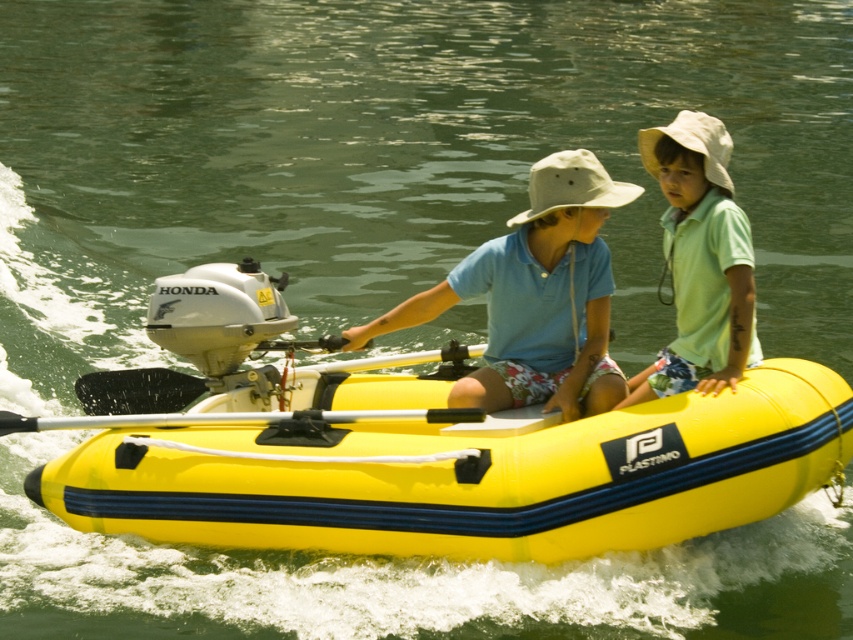
You are a safety inspector checking the boat setup. The yellow rubber boat at center must be positioned correctly relative to the silver metallic paddle at center for safe operation. According to the manufacturer guidelines, the boat should always be in front of the paddle to prevent engine damage. Is the current arrangement compliant with safety standards?

The yellow rubber boat at center is in front of the silver metallic paddle at center, which aligns with the manufacturer guidelines. This arrangement prevents engine damage and is compliant with safety standards.

You are a safety inspector checking the distance between the yellow rubber boat at center and the green matte shirt at upper right. The safety regulation requires a minimum distance of 2 meters between any two objects on a boat for emergency exits. Is the current distance compliant with the regulation?

The yellow rubber boat at center and the green matte shirt at upper right are 2.15 meters apart, which exceeds the minimum required distance of 2 meters. Therefore, the current distance is compliant with the safety regulation.

You are a photographer trying to capture a clear shot of both the white rubber paddle at center and the silver metallic paddle at center. Since you want both paddles to be in focus, which one should you focus on first to ensure the other is also sharp?

You should focus on the white rubber paddle at center first because it is closer to the viewer than the silver metallic paddle at center. By focusing on the closer object, the farther one will also be in focus due to the depth of field.